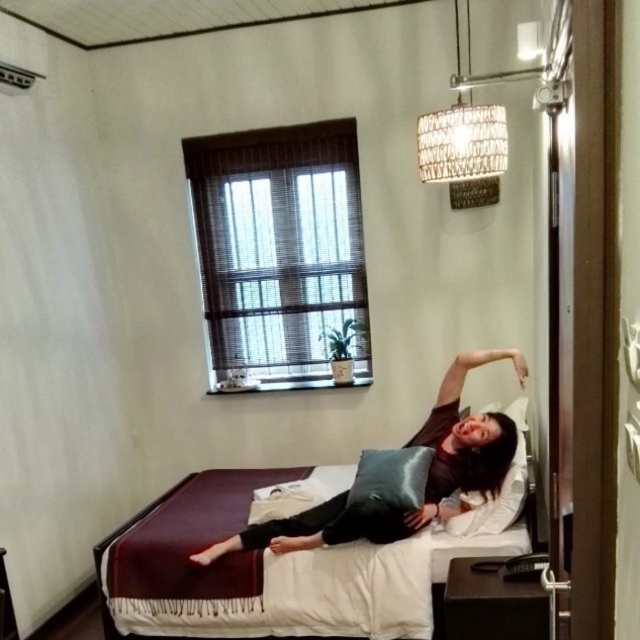
You are trying to decide whether to place a new decorative item on the maroon fabric bed at center or the dark brown leather pillow at center. Which surface has more space available for placing items?

The maroon fabric bed at center has a larger width than the dark brown leather pillow at center, so it has more space available for placing items.

You are taking a photo of the bedroom scene. You notice two points in the image labeled as point 1 and point 2. If point 1 is at coordinate point (147, 612) and point 2 is at coordinate point (364, 500), which point is closer to the camera?

Point 1 at coordinate point (147, 612) is closer to the camera than point 2 at coordinate point (364, 500) because the description states that point (147, 612) is further to the camera than point (364, 500). Wait, there is a contradiction here. Let me check again. The description says point (147, 612) is further to the camera than point (364, 500). Therefore, point 2 is further away, so point 1 is closer. Therefore, the correct answer is point 1 is closer.

You are trying to decide where to place a small nightstand in the bedroom. The nightstand is 1.2 meters tall. Considering the height of the maroon fabric bed at center and the silky black pillow at center, will the nightstand fit on top of either of these objects without exceeding their height?

The maroon fabric bed at center is much taller than the silky black pillow at center. The nightstand is 1.2 meters tall. Since the bed is taller, the nightstand can be placed on top of the maroon fabric bed at center as long as its height does not exceed the bed. However, the silky black pillow at center is shorter, so the nightstand would be too tall for it.